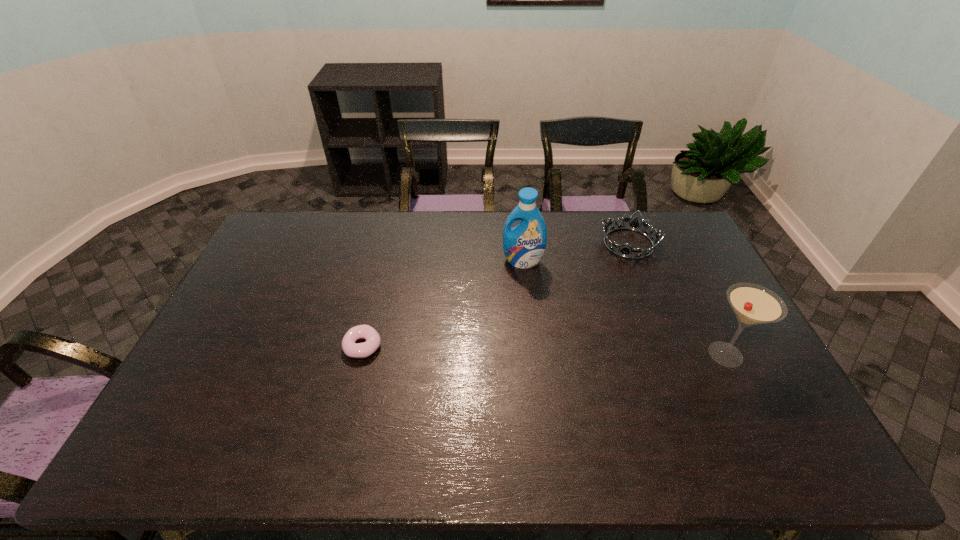
This screenshot has width=960, height=540. Identify the location of vacant space positioned 0.360m on the front-facing side of the detergent. (499, 350).

The width and height of the screenshot is (960, 540). I want to click on free space located 0.330m on the front-facing side of the third tallest object, so click(600, 325).

You are a GUI agent. You are given a task and a screenshot of the screen. Output one action in this format:
    pyautogui.click(x=<x>, y=<y>)
    Task: Click on the free space located on the front-facing side of the third tallest object
    
    Given the screenshot: What is the action you would take?
    pyautogui.click(x=609, y=301)

I want to click on free space located 0.240m on the front-facing side of the third tallest object, so click(607, 305).

This screenshot has height=540, width=960. Identify the location of object that is at the far edge. (634, 224).

This screenshot has height=540, width=960. I want to click on martini that is positioned at the right edge, so click(753, 304).

Find the location of `tiara that is at the right edge`. tiara that is at the right edge is located at coordinates (634, 224).

Find the location of a particular element. The width and height of the screenshot is (960, 540). object situated at the far right corner is located at coordinates click(x=634, y=224).

Where is `vacant region at the far edge of the desktop`? vacant region at the far edge of the desktop is located at coordinates (486, 215).

Identify the location of vacant space at the near edge. This screenshot has width=960, height=540. (320, 415).